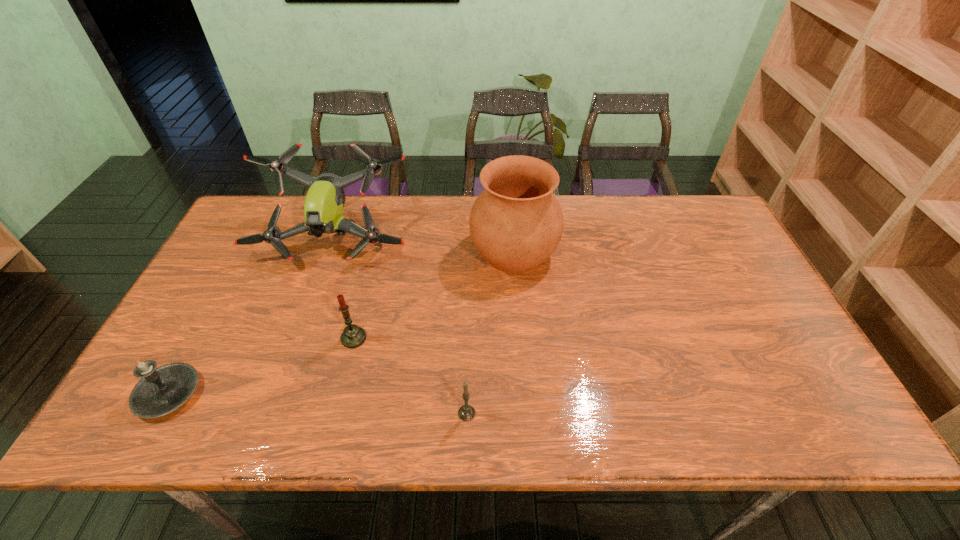
In order to click on unoccupied area between the pottery and the leftmost candle in this screenshot , I will do `click(341, 323)`.

In order to click on free space between the rightmost candle and the farthest candle in this screenshot , I will do `click(410, 376)`.

You are a GUI agent. You are given a task and a screenshot of the screen. Output one action in this format:
    pyautogui.click(x=<x>, y=<y>)
    Task: Click on the object that is the second closest one to the rightmost candle
    Image resolution: width=960 pixels, height=540 pixels.
    Given the screenshot: What is the action you would take?
    pyautogui.click(x=516, y=223)

Identify which object is the closest to the leftmost candle. Please provide its 2D coordinates. Your answer should be formatted as a tuple, i.e. [(x, y)], where the tuple contains the x and y coordinates of a point satisfying the conditions above.

[(353, 336)]

Where is `the second closest candle to the pottery`? The image size is (960, 540). the second closest candle to the pottery is located at coordinates (466, 413).

Locate which candle ranks in proximity to the rightmost candle. Please provide its 2D coordinates. Your answer should be formatted as a tuple, i.e. [(x, y)], where the tuple contains the x and y coordinates of a point satisfying the conditions above.

[(353, 336)]

Locate an element on the screen. blank space that satisfies the following two spatial constraints: 1. on the back side of the third nearest object; 2. on the right side of the leftmost candle is located at coordinates (199, 338).

At what (x,y) coordinates should I click in order to perform the action: click on free space that satisfies the following two spatial constraints: 1. on the front-facing side of the pottery; 2. on the right side of the drone. Please return your answer as a coordinate pair (x, y). Looking at the image, I should click on (330, 252).

I want to click on vacant position in the image that satisfies the following two spatial constraints: 1. on the front-facing side of the rightmost candle; 2. on the right side of the drone, so click(x=275, y=413).

This screenshot has width=960, height=540. I want to click on free location that satisfies the following two spatial constraints: 1. on the front-facing side of the drone; 2. on the left side of the pottery, so click(x=330, y=252).